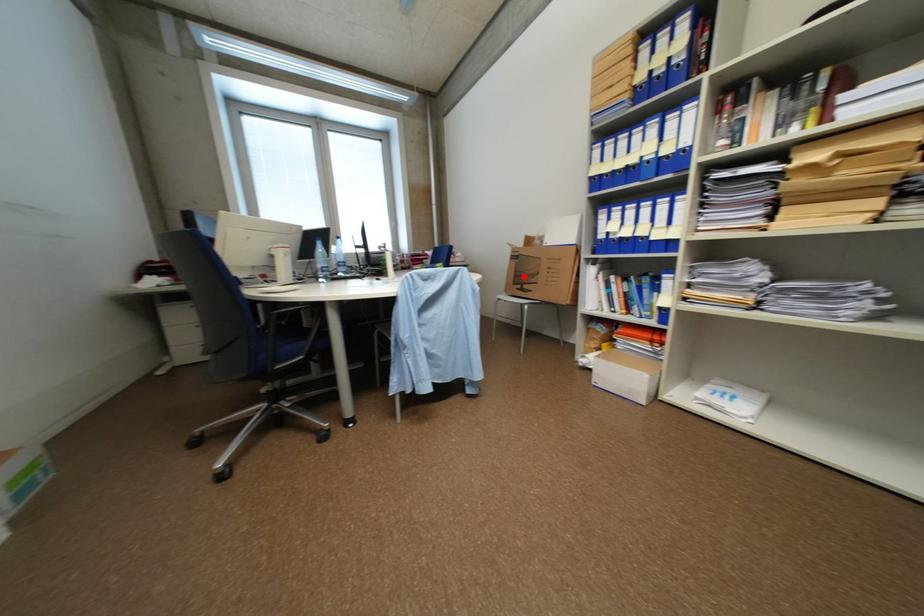
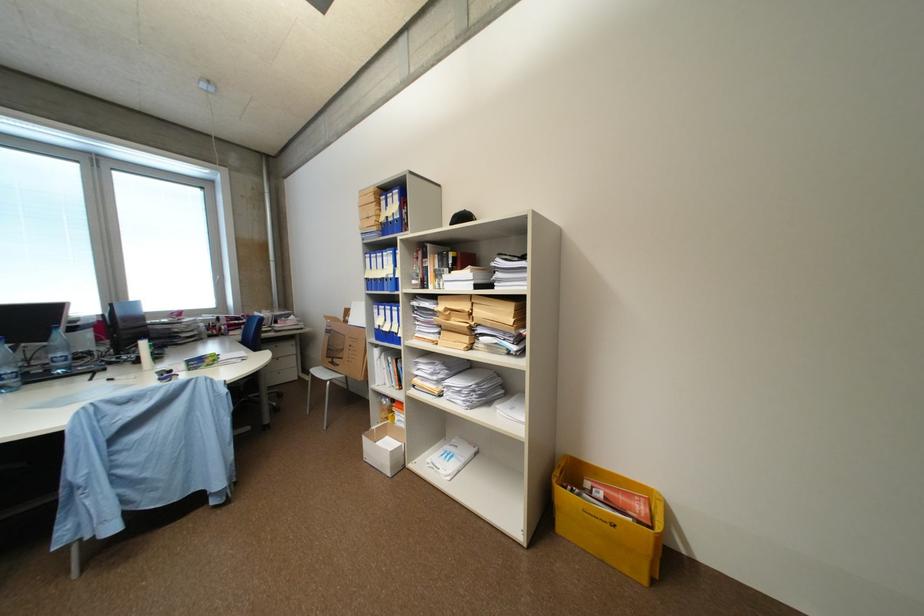
In the second image, find the point that corresponds to the highlighted location in the first image.

(336, 350)